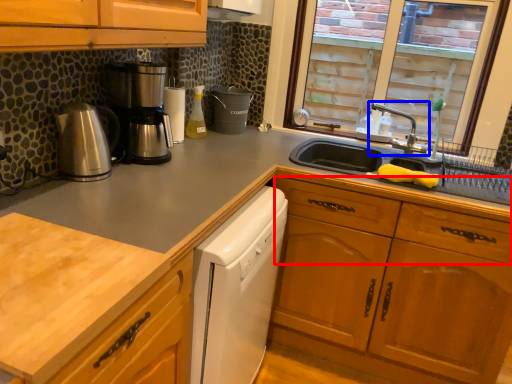
Question: Which object is closer to the camera taking this photo, drawer (highlighted by a red box) or tap (highlighted by a blue box)?

Choices:
 (A) drawer
 (B) tap

Answer: (A)